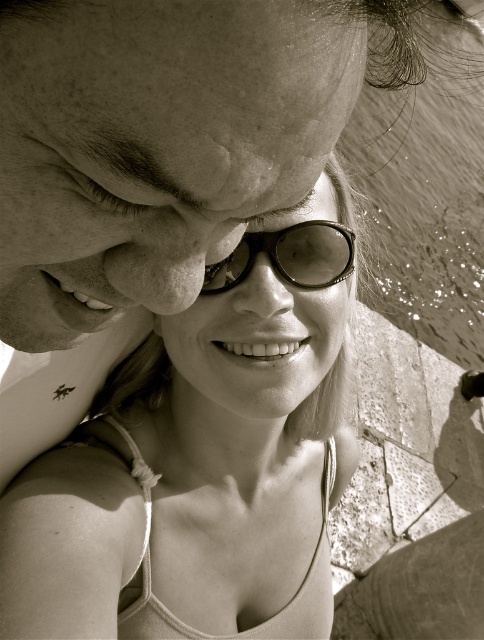
Who is positioned more to the left, smooth skin forehead at upper center or metallic reflective sunglasses at center?

smooth skin forehead at upper center is more to the left.

Based on the photo, does smooth skin forehead at upper center appear on the left side of metallic reflective sunglasses at center?

Yes, smooth skin forehead at upper center is to the left of metallic reflective sunglasses at center.

What do you see at coordinates (172, 104) in the screenshot?
I see `smooth skin forehead at upper center` at bounding box center [172, 104].

The image size is (484, 640). Identify the location of smooth skin forehead at upper center. (172, 104).

Who is more distant from viewer, (230, 356) or (207, 144)?

The point (230, 356) is behind.

Is the position of matte black sunglasses at center less distant than that of smooth skin forehead at upper center?

No.

Does point (271, 241) lie in front of point (241, 40)?

No, it is behind (241, 40).

Identify the location of matte black sunglasses at center. The height and width of the screenshot is (640, 484). (203, 458).

Can you confirm if matte black sunglasses at center is bigger than metallic reflective sunglasses at center?

Yes.

Consider the image. Does matte black sunglasses at center appear over metallic reflective sunglasses at center?

Incorrect, matte black sunglasses at center is not positioned above metallic reflective sunglasses at center.

The image size is (484, 640). In order to click on matte black sunglasses at center in this screenshot , I will do `click(203, 458)`.

I want to click on matte black sunglasses at center, so coord(203,458).